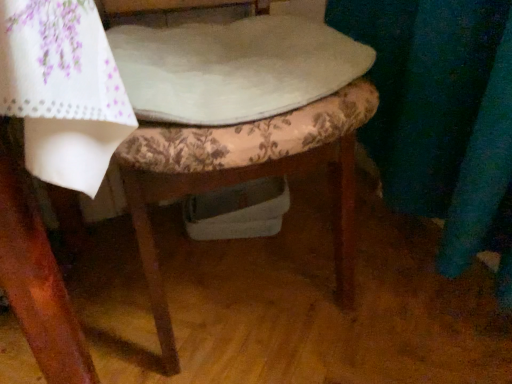
Image resolution: width=512 pixels, height=384 pixels. Identify the location of unoccupied region to the right of floral fabric cushion at center. (399, 272).